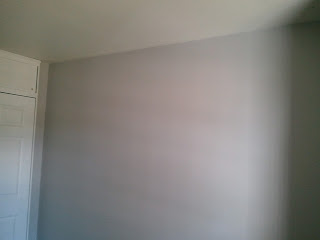
This screenshot has height=240, width=320. Find the location of `white wooden door`. white wooden door is located at coordinates (20, 127).